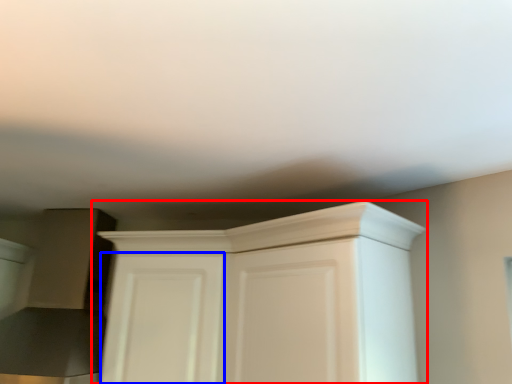
Question: Which point is further to the camera, cupboard (highlighted by a red box) or door (highlighted by a blue box)?

Choices:
 (A) cupboard
 (B) door

Answer: (B)